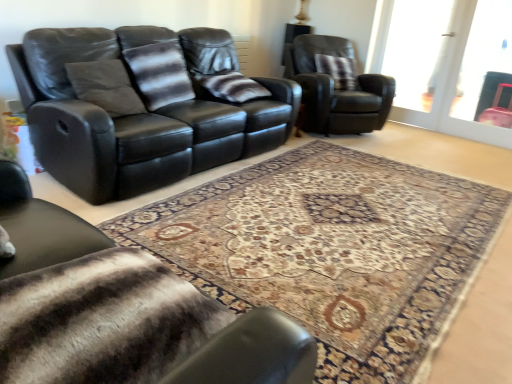
Locate an element on the screen. This screenshot has height=384, width=512. striped fabric pillow at center, which is counted as the second pillow, starting from the front is located at coordinates (231, 87).

Describe the element at coordinates (231, 87) in the screenshot. I see `striped fabric pillow at center, arranged as the 2th pillow when viewed from the right` at that location.

Image resolution: width=512 pixels, height=384 pixels. Describe the element at coordinates (330, 250) in the screenshot. I see `patterned carpet at center` at that location.

The height and width of the screenshot is (384, 512). What do you see at coordinates (338, 71) in the screenshot? I see `plush brown pillow at upper right, the first pillow from the back` at bounding box center [338, 71].

This screenshot has width=512, height=384. What do you see at coordinates (83, 290) in the screenshot? I see `striped fur blanket at lower left, which is the 2th chair from top to bottom` at bounding box center [83, 290].

Describe the element at coordinates (337, 86) in the screenshot. The height and width of the screenshot is (384, 512). I see `matte black armchair at upper right, acting as the second chair starting from the front` at that location.

Find the location of a particular element. striped fabric pillow at center, the second pillow viewed from the back is located at coordinates (231, 87).

Is matte black armchair at upper right, the 2th chair from the bottom, wider or thinner than patterned carpet at center?

Considering their sizes, matte black armchair at upper right, the 2th chair from the bottom, looks slimmer than patterned carpet at center.

From a real-world perspective, is matte black armchair at upper right, acting as the second chair starting from the front, under patterned carpet at center?

Actually, matte black armchair at upper right, acting as the second chair starting from the front, is physically above patterned carpet at center in the real world.

Is patterned carpet at center a part of matte black armchair at upper right, which is counted as the 2th chair, starting from the left?

Actually, patterned carpet at center is outside matte black armchair at upper right, which is counted as the 2th chair, starting from the left.

Would you say matte black armchair at upper right, acting as the second chair starting from the front, is part of striped fur blanket at lower left, positioned as the 2th chair in right-to-left order,'s contents?

No, matte black armchair at upper right, acting as the second chair starting from the front, is not inside striped fur blanket at lower left, positioned as the 2th chair in right-to-left order.

Which of these two, striped fur blanket at lower left, which is the 2th chair from top to bottom, or matte black armchair at upper right, which appears as the first chair when viewed from the top, is wider?

matte black armchair at upper right, which appears as the first chair when viewed from the top, is wider.

From the image's perspective, is striped fur blanket at lower left, acting as the 2th chair starting from the back, under matte black armchair at upper right, marked as the 1th chair in a back-to-front arrangement?

Yes, from the image's perspective, striped fur blanket at lower left, acting as the 2th chair starting from the back, is below matte black armchair at upper right, marked as the 1th chair in a back-to-front arrangement.

From a real-world perspective, who is located lower, striped fur blanket at lower left, acting as the 2th chair starting from the back, or matte black armchair at upper right, which ranks as the first chair in right-to-left order?

matte black armchair at upper right, which ranks as the first chair in right-to-left order, from a real-world perspective.

Between patterned carpet at center and plush brown pillow at upper right, positioned as the 3th pillow in front-to-back order, which one appears on the right side from the viewer's perspective?

Positioned to the right is plush brown pillow at upper right, positioned as the 3th pillow in front-to-back order.

Does patterned carpet at center have a larger size compared to plush brown pillow at upper right, the 3th pillow from the left?

Correct, patterned carpet at center is larger in size than plush brown pillow at upper right, the 3th pillow from the left.

Is patterned carpet at center positioned with its back to plush brown pillow at upper right, the 1th pillow viewed from the right?

No, patterned carpet at center is not facing away from plush brown pillow at upper right, the 1th pillow viewed from the right.

From the picture: Which object is further away from the camera taking this photo, transparent glass door at upper right or striped fur blanket at lower left, which ranks as the 1th chair in left-to-right order?

transparent glass door at upper right is behind.

Is transparent glass door at upper right wider or thinner than striped fur blanket at lower left, the 1th chair from the bottom?

transparent glass door at upper right is thinner than striped fur blanket at lower left, the 1th chair from the bottom.

The image size is (512, 384). I want to click on window behind the striped fur blanket at lower left, acting as the 2th chair starting from the back, so click(485, 59).

Is transparent glass door at upper right oriented away from striped fur blanket at lower left, acting as the 2th chair starting from the back?

No, striped fur blanket at lower left, acting as the 2th chair starting from the back, is not at the back of transparent glass door at upper right.

From the picture: How much distance is there between striped fur blanket at lower left, the 1th chair from the bottom, and transparent glass door at upper right?

5.36 meters.

From a real-world perspective, is striped fur blanket at lower left, the 1th chair from the bottom, on transparent glass door at upper right?

No.

Considering their positions, is striped fur blanket at lower left, acting as the 2th chair starting from the back, located in front of or behind transparent glass door at upper right?

Visually, striped fur blanket at lower left, acting as the 2th chair starting from the back, is located in front of transparent glass door at upper right.

The width and height of the screenshot is (512, 384). I want to click on the 2nd chair positioned below the transparent glass door at upper right (from the image's perspective), so click(x=83, y=290).

Which is less distant, [228,187] or [195,79]?

Point [228,187].

Based on the photo, is patterned carpet at center not near striped fabric pillow at center, arranged as the 2th pillow when viewed from the right?

Yes, patterned carpet at center and striped fabric pillow at center, arranged as the 2th pillow when viewed from the right, are located far from each other.

Which object is positioned more to the left, patterned carpet at center or striped fabric pillow at center, arranged as the 2th pillow when viewed from the left?

striped fabric pillow at center, arranged as the 2th pillow when viewed from the left.

How many degrees apart are the facing directions of patterned carpet at center and striped fabric pillow at center, arranged as the 2th pillow when viewed from the right?

There is a 89-degree angle between the facing directions of patterned carpet at center and striped fabric pillow at center, arranged as the 2th pillow when viewed from the right.

Which of these two, transparent glass screen door at upper right or matte black armchair at upper right, acting as the second chair starting from the front, is wider?

With larger width is matte black armchair at upper right, acting as the second chair starting from the front.

Is transparent glass screen door at upper right further to the viewer compared to matte black armchair at upper right, acting as the second chair starting from the front?

Yes, transparent glass screen door at upper right is behind matte black armchair at upper right, acting as the second chair starting from the front.

Is matte black armchair at upper right, which ranks as the first chair in right-to-left order, located within transparent glass screen door at upper right?

No, matte black armchair at upper right, which ranks as the first chair in right-to-left order, is located outside of transparent glass screen door at upper right.

From the image's perspective, is transparent glass screen door at upper right below matte black armchair at upper right, which ranks as the first chair in right-to-left order?

No.

Identify the location of mat that appears on the left of matte black armchair at upper right, the 2th chair from the bottom. (330, 250).

At what (x,y) coordinates should I click in order to perform the action: click on chair located above the matte black armchair at upper right, which is counted as the 2th chair, starting from the left (from a real-world perspective). Please return your answer as a coordinate pair (x, y). Image resolution: width=512 pixels, height=384 pixels. Looking at the image, I should click on (83, 290).

Which object lies further to the anchor point striped fabric pillow at center, arranged as the 2th pillow when viewed from the left, striped fur blanket at lower left, which ranks as the 1th chair in left-to-right order, or striped fabric pillow at center, acting as the 1th pillow starting from the left?

Based on the image, striped fur blanket at lower left, which ranks as the 1th chair in left-to-right order, appears to be further to striped fabric pillow at center, arranged as the 2th pillow when viewed from the left.

Which object lies further to the anchor point black leather couch at upper left, striped fabric pillow at center, which is the 1th pillow from front to back, or matte black armchair at upper right, the 2th chair from the bottom?

matte black armchair at upper right, the 2th chair from the bottom.

Which object lies further to the anchor point striped fabric pillow at center, which is counted as the second pillow, starting from the front, transparent glass screen door at upper right or transparent glass door at upper right?

transparent glass door at upper right.

Estimate the real-world distances between objects in this image. Which object is further from transparent glass door at upper right, transparent glass screen door at upper right or black leather couch at upper left?

black leather couch at upper left.

Estimate the real-world distances between objects in this image. Which object is further from matte black armchair at upper right, the 2th chair from the bottom, transparent glass screen door at upper right or patterned carpet at center?

Based on the image, patterned carpet at center appears to be further to matte black armchair at upper right, the 2th chair from the bottom.

Considering their positions, is striped fabric pillow at center, which is counted as the second pillow, starting from the front, positioned closer to striped fabric pillow at center, the 3th pillow viewed from the back, than striped fur blanket at lower left, positioned as the 2th chair in right-to-left order?

Among the two, striped fabric pillow at center, which is counted as the second pillow, starting from the front, is located nearer to striped fabric pillow at center, the 3th pillow viewed from the back.

Considering their positions, is black leather couch at upper left positioned closer to matte black armchair at upper right, acting as the second chair starting from the front, than striped fabric pillow at center, the second pillow viewed from the back?

striped fabric pillow at center, the second pillow viewed from the back, is closer to matte black armchair at upper right, acting as the second chair starting from the front.

Considering their positions, is plush brown pillow at upper right, positioned as the 3th pillow in front-to-back order, positioned further to transparent glass screen door at upper right than striped fabric pillow at center, the second pillow viewed from the back?

striped fabric pillow at center, the second pillow viewed from the back.

Identify the location of window between patterned carpet at center and plush brown pillow at upper right, the first pillow from the back, in the front-back direction. Image resolution: width=512 pixels, height=384 pixels. (485, 59).

The width and height of the screenshot is (512, 384). Identify the location of studio couch between striped fur blanket at lower left, the 1th chair from the bottom, and matte black armchair at upper right, which ranks as the first chair in right-to-left order, in the front-back direction. (139, 107).

Locate an element on the screen. screen door positioned between striped fur blanket at lower left, the 1th chair from the front, and transparent glass door at upper right from near to far is located at coordinates [x=453, y=88].

Where is `chair situated between striped fabric pillow at center, arranged as the 2th pillow when viewed from the left, and plush brown pillow at upper right, the first pillow from the back, from left to right`? This screenshot has height=384, width=512. chair situated between striped fabric pillow at center, arranged as the 2th pillow when viewed from the left, and plush brown pillow at upper right, the first pillow from the back, from left to right is located at coordinates (337, 86).